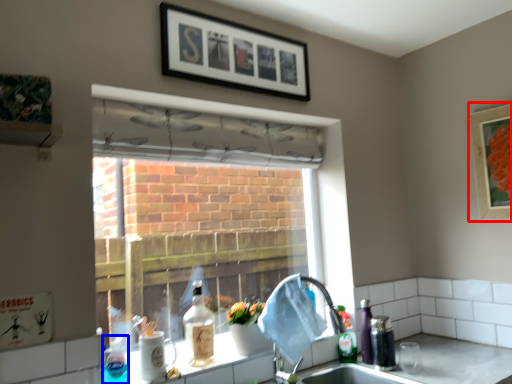
Question: Which point is closer to the camera, picture frame (highlighted by a red box) or bottle (highlighted by a blue box)?

Choices:
 (A) picture frame
 (B) bottle

Answer: (B)